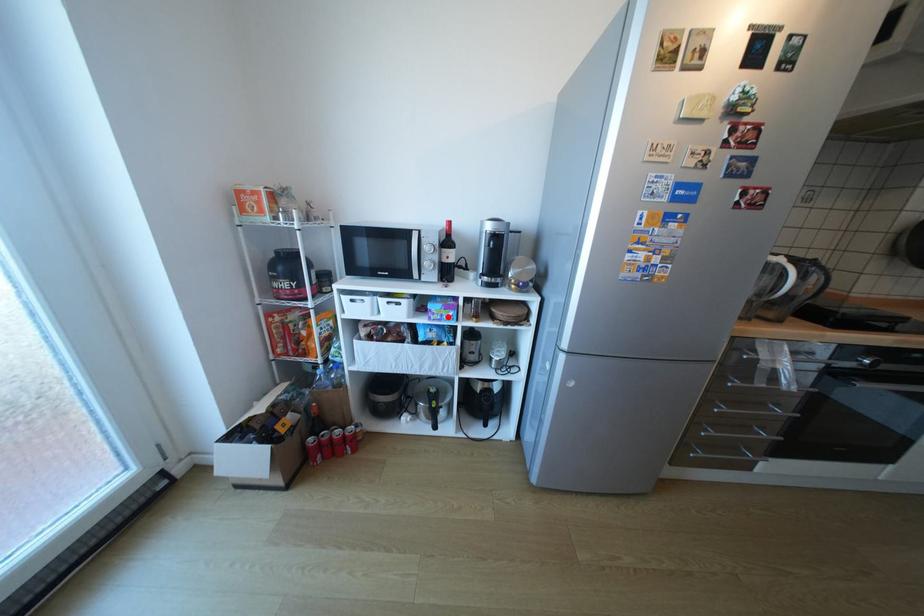
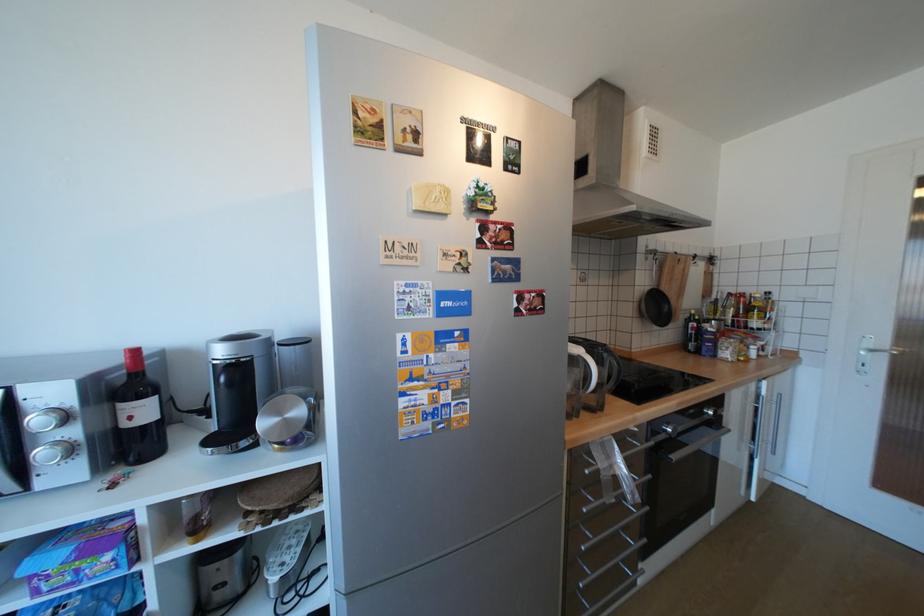
Where in the second image is the point corresponding to the highlighted location from the first image?

(79, 578)